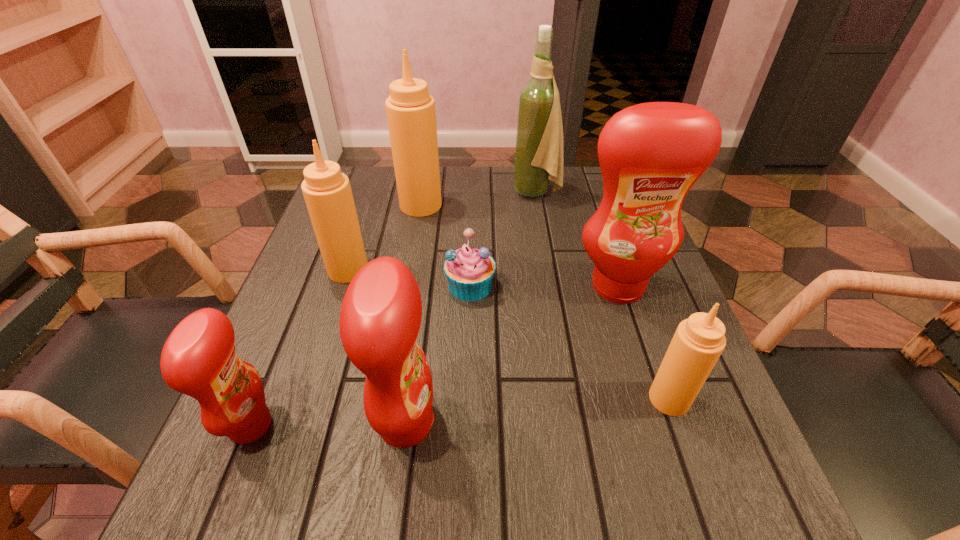
This screenshot has width=960, height=540. Identify the location of free space located 0.150m on the label side of the leftmost red condiment. (369, 425).

Where is `free region located on the back of the nearest tan condiment`? The width and height of the screenshot is (960, 540). free region located on the back of the nearest tan condiment is located at coordinates (614, 245).

Where is `vacant region located on the right of the blue muffin`? This screenshot has width=960, height=540. vacant region located on the right of the blue muffin is located at coordinates (572, 286).

The width and height of the screenshot is (960, 540). I want to click on wine bottle that is at the far edge, so click(539, 137).

Image resolution: width=960 pixels, height=540 pixels. I want to click on condiment at the far edge, so click(410, 109).

Locate an element on the screen. object at the near edge is located at coordinates (380, 318).

Where is `vacant space at the far edge of the desktop`? vacant space at the far edge of the desktop is located at coordinates (442, 215).

Where is `vacant space at the near edge of the desktop`? vacant space at the near edge of the desktop is located at coordinates (573, 504).

Image resolution: width=960 pixels, height=540 pixels. Identify the location of vacant space at the left edge. (295, 298).

The height and width of the screenshot is (540, 960). I want to click on vacant region at the right edge of the desktop, so click(x=721, y=422).